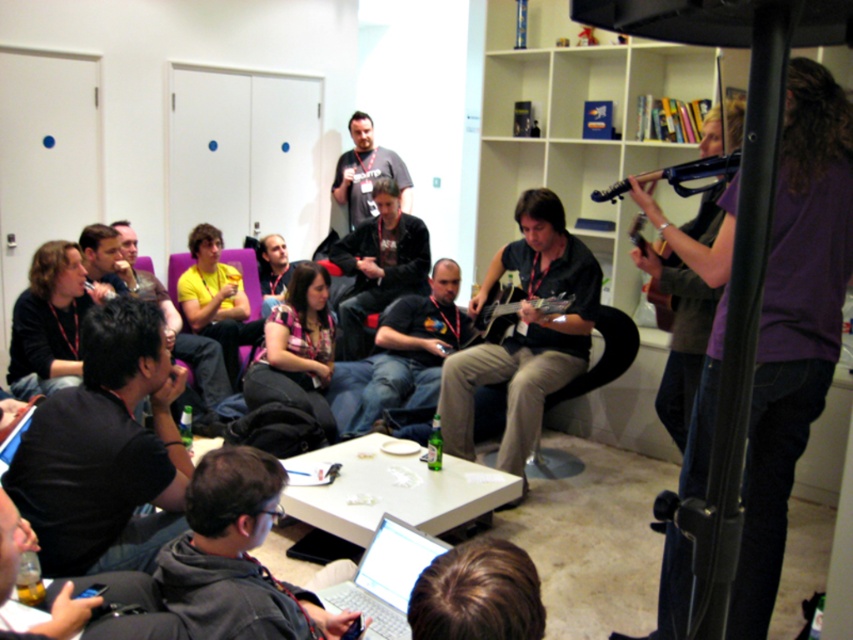
You are a photographer positioned behind the purple fabric armchair at center and want to take a photo of the black matte guitar at center. Can you see the guitar clearly without moving your position?

The black matte guitar at center is in front of the purple fabric armchair at center, so yes, you can see the guitar clearly without moving your position.